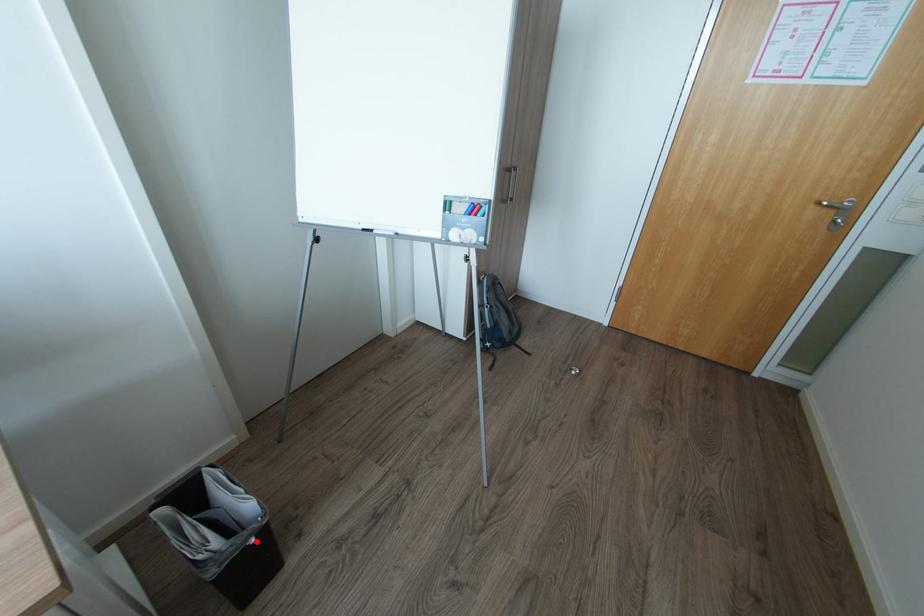
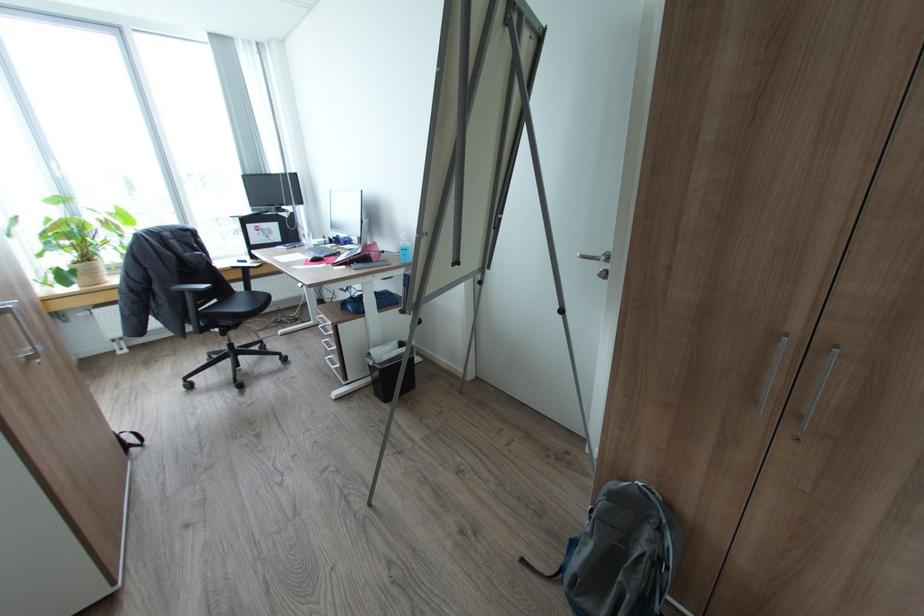
Question: I am providing you with two images of the same scene from different viewpoints. Image1 has a red point marked. In image2, the corresponding 3D location appears at what relative position? Reply with the corresponding letter.

Choices:
 (A) Closer
 (B) Farther

Answer: (B)